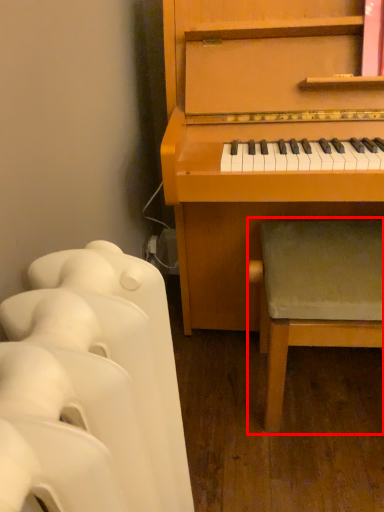
Question: From the image's perspective, where is music stool (annotated by the red box) located in relation to furniture in the image?

Choices:
 (A) above
 (B) below

Answer: (A)